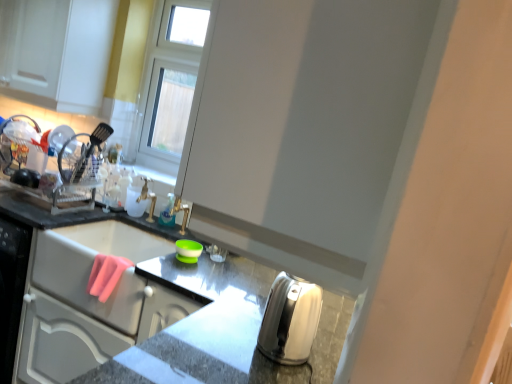
This screenshot has width=512, height=384. Identify the location of vacant point to the left of translucent plastic bottle at center. (137, 216).